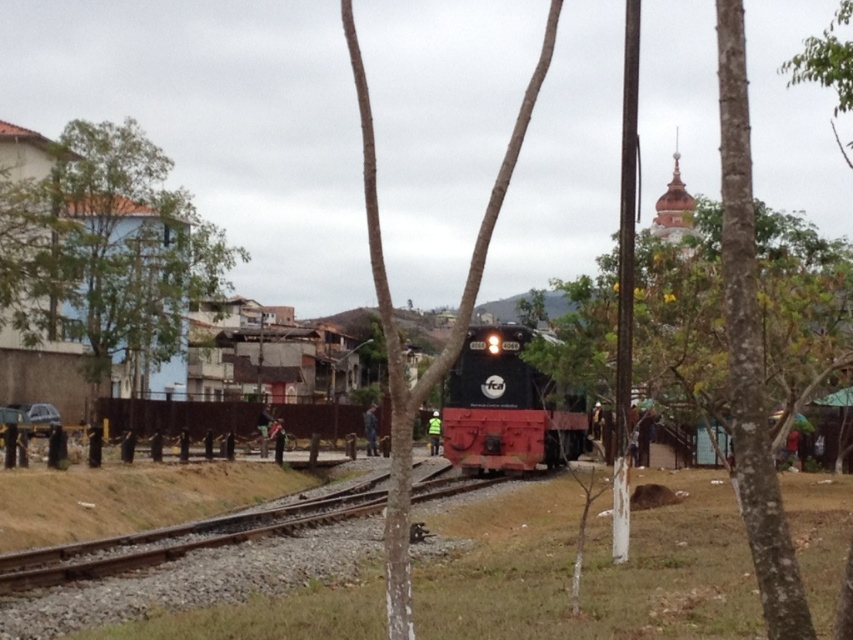
You are a passenger on the train and looking out the window. You see a smooth bark tree at center and a black glossy locomotive at center. Which object is closer to you?

The smooth bark tree at center is closer to you because it is positioned over the black glossy locomotive at center, indicating it is in front.